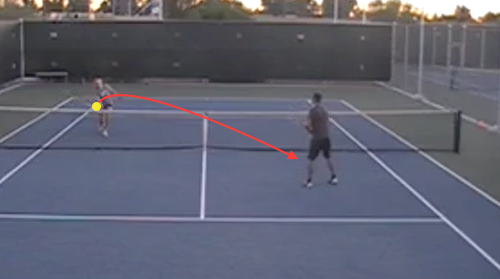
Locate an element on the screen. This screenshot has width=500, height=279. bench is located at coordinates (49, 76).